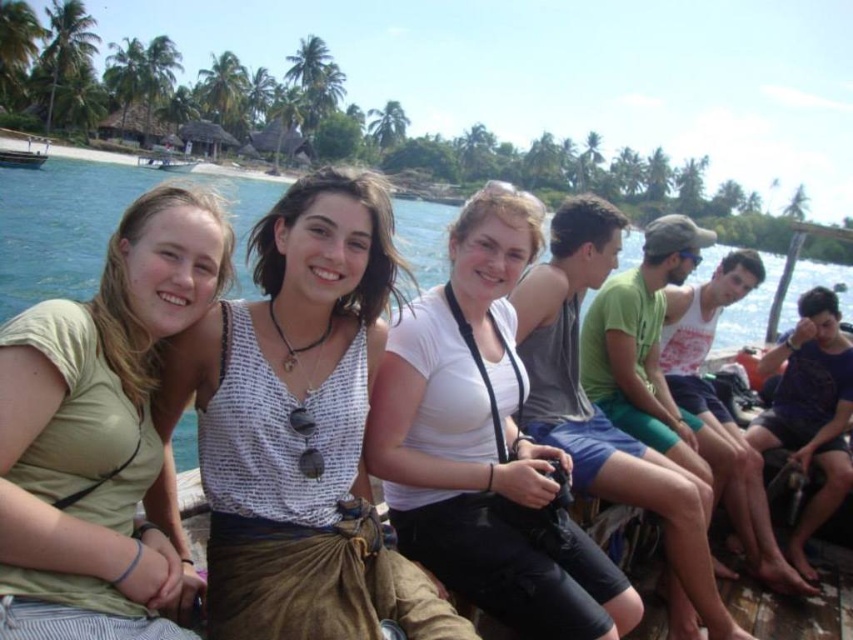
Question: Does white printed tank top at center appear under white plastic boat at left?

Choices:
 (A) yes
 (B) no

Answer: (A)

Question: Can you confirm if white plastic boat at upper left is positioned above white plastic boat at left?

Choices:
 (A) yes
 (B) no

Answer: (A)

Question: Which point appears farthest from the camera in this image?

Choices:
 (A) (70, 438)
 (B) (445, 426)
 (C) (44, 156)
 (D) (184, 161)

Answer: (D)

Question: Can you confirm if white printed tank top at center is positioned above white matte shirt at center?

Choices:
 (A) no
 (B) yes

Answer: (A)

Question: Which point appears closest to the camera in this image?

Choices:
 (A) (33, 161)
 (B) (157, 241)
 (C) (254, 438)
 (D) (555, 563)

Answer: (B)

Question: Which point is farther from the camera taking this photo?

Choices:
 (A) (28, 154)
 (B) (537, 561)
 (C) (148, 481)

Answer: (A)